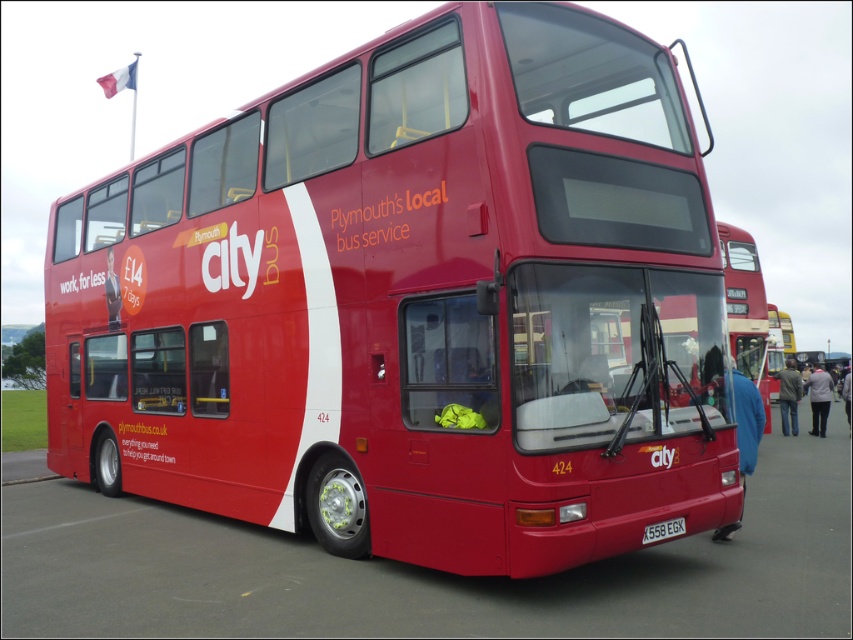
Question: Is shiny red bus at center smaller than red rubber parking lot at lower center?

Choices:
 (A) yes
 (B) no

Answer: (B)

Question: Estimate the real-world distances between objects in this image. Which object is farther from the black plastic license plate at center?

Choices:
 (A) red rubber parking lot at lower center
 (B) shiny red bus at center

Answer: (B)

Question: Which object is positioned closest to the shiny red bus at center?

Choices:
 (A) red rubber parking lot at lower center
 (B) black plastic license plate at center

Answer: (A)

Question: Can you confirm if shiny red bus at center is positioned to the left of black plastic license plate at center?

Choices:
 (A) yes
 (B) no

Answer: (A)

Question: Which point is farther to the camera?

Choices:
 (A) (177, 346)
 (B) (645, 540)

Answer: (A)

Question: From the image, what is the correct spatial relationship of red rubber parking lot at lower center in relation to black plastic license plate at center?

Choices:
 (A) above
 (B) below

Answer: (B)